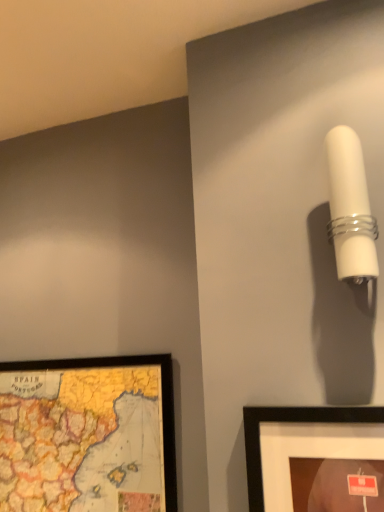
Question: From the image's perspective, is white glossy wall sconce at upper right located above or below wooden map at lower left?

Choices:
 (A) below
 (B) above

Answer: (B)

Question: Considering the positions of white glossy wall sconce at upper right and wooden map at lower left in the image, is white glossy wall sconce at upper right wider or thinner than wooden map at lower left?

Choices:
 (A) wide
 (B) thin

Answer: (A)

Question: Would you say white glossy wall sconce at upper right is to the left or to the right of wooden map at lower left in the picture?

Choices:
 (A) right
 (B) left

Answer: (A)

Question: From a real-world perspective, is wooden map at lower left physically located above or below white glossy wall sconce at upper right?

Choices:
 (A) below
 (B) above

Answer: (A)

Question: Based on their positions, is wooden map at lower left located to the left or right of white glossy wall sconce at upper right?

Choices:
 (A) right
 (B) left

Answer: (B)

Question: From the image's perspective, is wooden map at lower left positioned above or below white glossy wall sconce at upper right?

Choices:
 (A) below
 (B) above

Answer: (A)

Question: Based on their sizes in the image, would you say wooden map at lower left is bigger or smaller than white glossy wall sconce at upper right?

Choices:
 (A) small
 (B) big

Answer: (B)